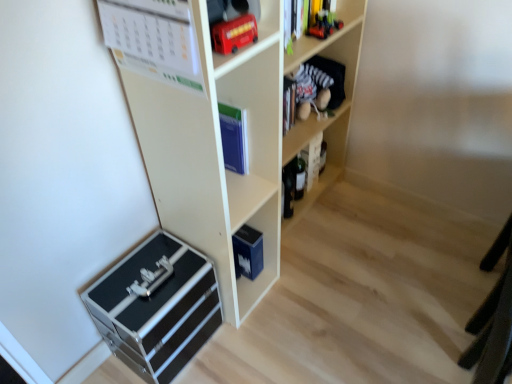
Find the location of `free space between matte black toolbox at lower left, placed as the second shelf when sorted from bottom to top, and black metallic toolbox at lower left, the first shelf when ordered from bottom to top`. free space between matte black toolbox at lower left, placed as the second shelf when sorted from bottom to top, and black metallic toolbox at lower left, the first shelf when ordered from bottom to top is located at coordinates (217, 352).